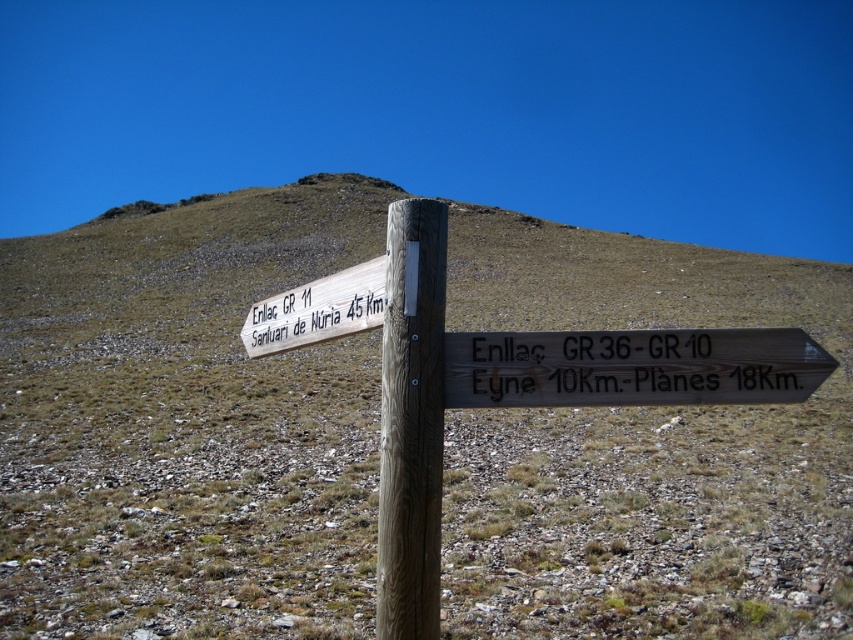
You are a hiker standing at the base of the mountain and see the wooden signpost at center and the brown wood post at center. Which one is closer to you?

The wooden signpost at center is closer to you because it is further to the viewer than the brown wood post at center.

You are a hiker planning to follow the GR 11 trail to the Santuari de Nuri. You see the weathered wood sign at center and the brown wood post at center. Which object is shorter?

The weathered wood sign at center is shorter than the brown wood post at center.

You are a hiker planning to take the GR 11 trail to the Santuari de Nuri a. You see the wooden signpost at center and the wooden sign at upper left. Which one is wider?

The wooden signpost at center might be wider than wooden sign at upper left.